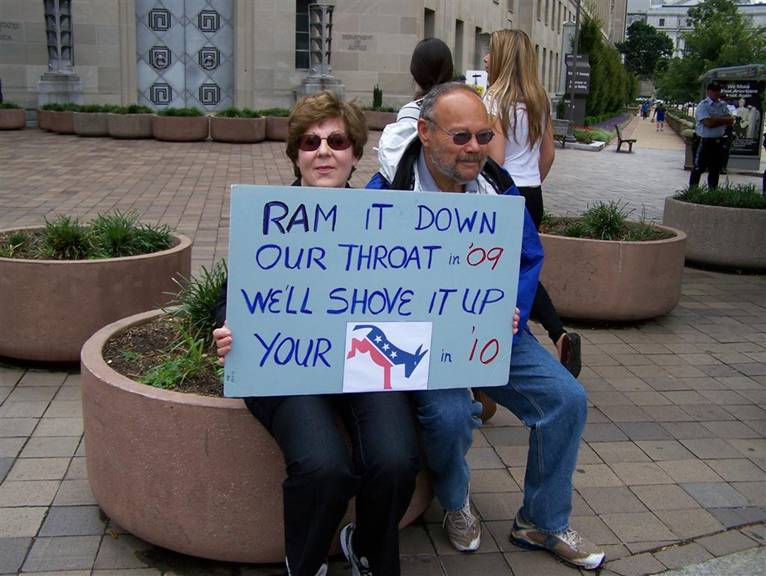
You are a GUI agent. You are given a task and a screenshot of the screen. Output one action in this format:
    pyautogui.click(x=<x>, y=<y>)
    Task: Click on the planters
    The height and width of the screenshot is (576, 766).
    Given the screenshot: What is the action you would take?
    pyautogui.click(x=619, y=264), pyautogui.click(x=143, y=397), pyautogui.click(x=44, y=278), pyautogui.click(x=725, y=225)